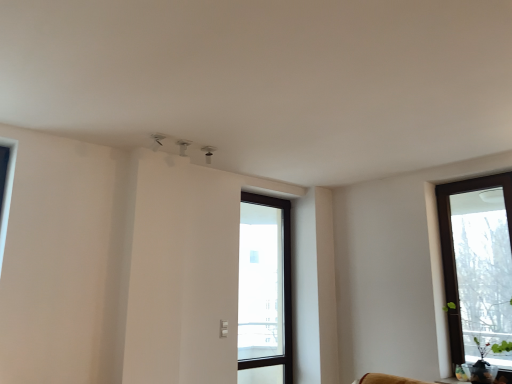
How much space does transparent glass door at center, the second window in the front-to-back sequence, occupy horizontally?

The width of transparent glass door at center, the second window in the front-to-back sequence, is 4.31 inches.

The width and height of the screenshot is (512, 384). Describe the element at coordinates (264, 290) in the screenshot. I see `transparent glass door at center, the second window in the front-to-back sequence` at that location.

Image resolution: width=512 pixels, height=384 pixels. Find the location of `transparent glass door at center, arranged as the first window when viewed from the back`. transparent glass door at center, arranged as the first window when viewed from the back is located at coordinates (264, 290).

This screenshot has height=384, width=512. Describe the element at coordinates (477, 266) in the screenshot. I see `brown wooden window at right, the 2th window from the left` at that location.

In order to face brown wooden window at right, the first window from the front, should I rotate leftwards or rightwards?

Turn right approximately 27.857 degrees to face it.

At what (x,y) coordinates should I click in order to perform the action: click on brown wooden window at right, the first window from the front. Please return your answer as a coordinate pair (x, y). Image resolution: width=512 pixels, height=384 pixels. Looking at the image, I should click on (477, 266).

Where is `transparent glass door at center, arranged as the first window when viewed from the left`? The height and width of the screenshot is (384, 512). transparent glass door at center, arranged as the first window when viewed from the left is located at coordinates (264, 290).

In the scene shown: Considering the positions of objects transparent glass door at center, arranged as the first window when viewed from the left, and brown wooden window at right, arranged as the second window when viewed from the back, in the image provided, who is more to the right, transparent glass door at center, arranged as the first window when viewed from the left, or brown wooden window at right, arranged as the second window when viewed from the back,?

Positioned to the right is brown wooden window at right, arranged as the second window when viewed from the back.

In the image, is transparent glass door at center, arranged as the first window when viewed from the back, positioned in front of or behind brown wooden window at right, arranged as the second window when viewed from the back?

In the image, transparent glass door at center, arranged as the first window when viewed from the back, appears behind brown wooden window at right, arranged as the second window when viewed from the back.

Which is more distant, (264, 296) or (477, 347)?

The point (264, 296) is behind.

From the image's perspective, is transparent glass door at center, arranged as the first window when viewed from the back, below brown wooden window at right, the 2th window from the left?

Yes, from the image's perspective, transparent glass door at center, arranged as the first window when viewed from the back, is beneath brown wooden window at right, the 2th window from the left.

From a real-world perspective, is transparent glass door at center, arranged as the first window when viewed from the left, physically located above or below brown wooden window at right, the 2th window from the left?

In terms of real-world spatial position, transparent glass door at center, arranged as the first window when viewed from the left, is below brown wooden window at right, the 2th window from the left.

Is transparent glass door at center, the second window in the front-to-back sequence, wider than brown wooden window at right, arranged as the second window when viewed from the back?

In fact, transparent glass door at center, the second window in the front-to-back sequence, might be narrower than brown wooden window at right, arranged as the second window when viewed from the back.

Between transparent glass door at center, arranged as the 2th window when viewed from the right, and brown wooden window at right, acting as the first window starting from the right, which one has more height?

transparent glass door at center, arranged as the 2th window when viewed from the right, is taller.

Who is bigger, transparent glass door at center, arranged as the first window when viewed from the back, or brown wooden window at right, the 2th window from the left?

With larger size is brown wooden window at right, the 2th window from the left.

Do you think transparent glass door at center, arranged as the first window when viewed from the left, is within brown wooden window at right, the 2th window from the left, or outside of it?

The correct answer is: outside.

Is there a large distance between transparent glass door at center, arranged as the first window when viewed from the back, and brown wooden window at right, the first window from the front?

transparent glass door at center, arranged as the first window when viewed from the back, is far away from brown wooden window at right, the first window from the front.

Is transparent glass door at center, arranged as the 2th window when viewed from the right, facing away from brown wooden window at right, the 2th window from the left?

No, brown wooden window at right, the 2th window from the left, is not at the back of transparent glass door at center, arranged as the 2th window when viewed from the right.

This screenshot has height=384, width=512. Identify the location of window that is on the left side of brown wooden window at right, acting as the first window starting from the right. (264, 290).

Between brown wooden window at right, the first window from the front, and transparent glass door at center, arranged as the first window when viewed from the left, which one appears on the right side from the viewer's perspective?

brown wooden window at right, the first window from the front.

Is brown wooden window at right, acting as the first window starting from the right, further to the viewer compared to transparent glass door at center, arranged as the 2th window when viewed from the right?

That is False.

Is point (466, 232) positioned behind point (273, 203)?

No, (466, 232) is closer to viewer.

From the image's perspective, which one is positioned lower, brown wooden window at right, the 2th window from the left, or transparent glass door at center, arranged as the 2th window when viewed from the right?

transparent glass door at center, arranged as the 2th window when viewed from the right.

From a real-world perspective, which object stands above the other?

From a 3D spatial view, brown wooden window at right, the 2th window from the left, is above.

Can you confirm if brown wooden window at right, acting as the first window starting from the right, is thinner than transparent glass door at center, arranged as the 2th window when viewed from the right?

In fact, brown wooden window at right, acting as the first window starting from the right, might be wider than transparent glass door at center, arranged as the 2th window when viewed from the right.

Who is taller, brown wooden window at right, acting as the first window starting from the right, or transparent glass door at center, arranged as the 2th window when viewed from the right?

With more height is transparent glass door at center, arranged as the 2th window when viewed from the right.

Looking at the image, does brown wooden window at right, the first window from the front, seem bigger or smaller compared to transparent glass door at center, arranged as the first window when viewed from the left?

Clearly, brown wooden window at right, the first window from the front, is larger in size than transparent glass door at center, arranged as the first window when viewed from the left.

From the picture: Is brown wooden window at right, arranged as the second window when viewed from the back, not within transparent glass door at center, arranged as the first window when viewed from the left?

Yes, brown wooden window at right, arranged as the second window when viewed from the back, is located beyond the bounds of transparent glass door at center, arranged as the first window when viewed from the left.

Is there a large distance between brown wooden window at right, the first window from the front, and transparent glass door at center, arranged as the first window when viewed from the left?

Yes.

Could you tell me if brown wooden window at right, acting as the first window starting from the right, is turned towards transparent glass door at center, arranged as the 2th window when viewed from the right?

No, brown wooden window at right, acting as the first window starting from the right, is not turned towards transparent glass door at center, arranged as the 2th window when viewed from the right.

Can you tell me how much brown wooden window at right, arranged as the second window when viewed from the back, and transparent glass door at center, arranged as the first window when viewed from the back, differ in facing direction?

They differ by 88.7 degrees in their facing directions.

How distant is brown wooden window at right, the 2th window from the left, from transparent glass door at center, arranged as the 2th window when viewed from the right?

A distance of 6.06 feet exists between brown wooden window at right, the 2th window from the left, and transparent glass door at center, arranged as the 2th window when viewed from the right.

At what (x,y) coordinates should I click in order to perform the action: click on window below the brown wooden window at right, acting as the first window starting from the right (from a real-world perspective). Please return your answer as a coordinate pair (x, y). This screenshot has width=512, height=384. Looking at the image, I should click on (264, 290).

I want to click on window that appears on the right of transparent glass door at center, the second window in the front-to-back sequence, so click(x=477, y=266).

Where is `window that is in front of the transparent glass door at center, arranged as the 2th window when viewed from the right`? window that is in front of the transparent glass door at center, arranged as the 2th window when viewed from the right is located at coordinates (477, 266).